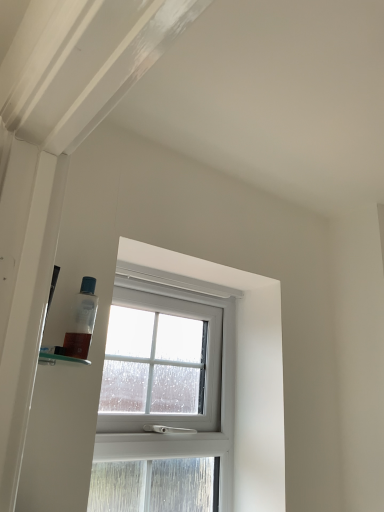
What do you see at coordinates (81, 321) in the screenshot?
I see `translucent plastic bottle at upper left` at bounding box center [81, 321].

You are a GUI agent. You are given a task and a screenshot of the screen. Output one action in this format:
    pyautogui.click(x=<x>, y=<y>)
    Task: Click on the translucent plastic bottle at upper left
    This screenshot has height=512, width=384.
    Given the screenshot: What is the action you would take?
    pyautogui.click(x=81, y=321)

Looking at this image, what is the approximate width of translucent plastic bottle at upper left?

translucent plastic bottle at upper left is 3.24 centimeters in width.

This screenshot has height=512, width=384. In order to click on translucent plastic bottle at upper left in this screenshot , I will do `click(81, 321)`.